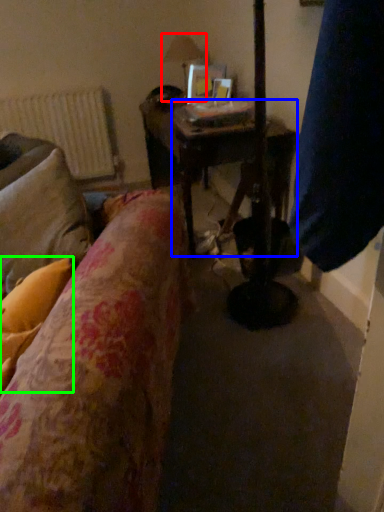
Question: Estimate the real-world distances between objects in this image. Which object is closer to table lamp (highlighted by a red box), table (highlighted by a blue box) or pillow (highlighted by a green box)?

Choices:
 (A) table
 (B) pillow

Answer: (A)